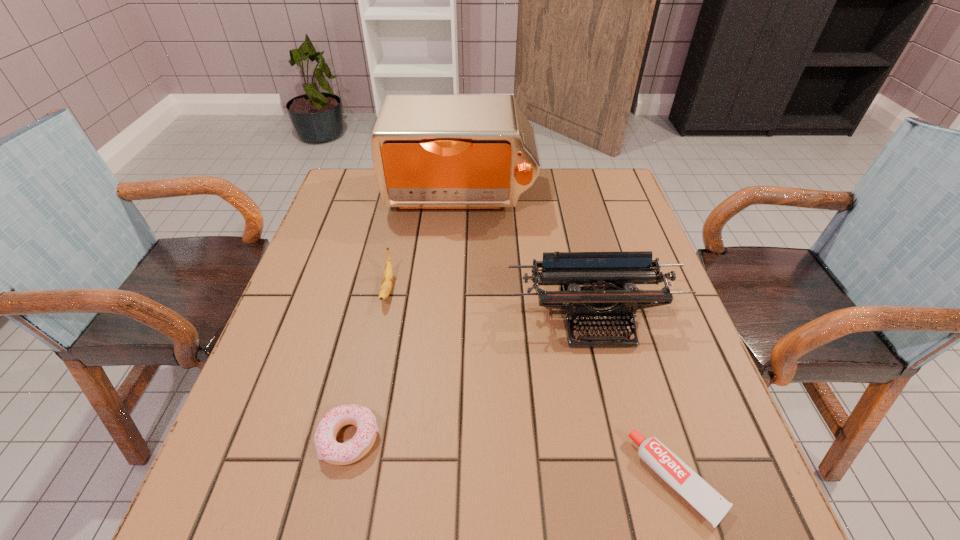
I want to click on blank region between the doughnut and the fourth shortest object, so click(472, 379).

Find the location of a particular element. free area in between the typewriter and the third shortest object is located at coordinates (492, 304).

Where is `empty space between the farthest object and the typewriter`? empty space between the farthest object and the typewriter is located at coordinates (527, 258).

Find the location of a particular element. This screenshot has height=540, width=960. object that stands as the third closest to the toothpaste is located at coordinates (387, 281).

At what (x,y) coordinates should I click in order to perform the action: click on object that stands as the third closest to the third tallest object. Please return your answer as a coordinate pair (x, y). The width and height of the screenshot is (960, 540). Looking at the image, I should click on (608, 278).

This screenshot has width=960, height=540. Find the location of `free space in the image that satisfies the following two spatial constraints: 1. on the door side of the toothpaste; 2. on the left side of the toaster oven`. free space in the image that satisfies the following two spatial constraints: 1. on the door side of the toothpaste; 2. on the left side of the toaster oven is located at coordinates (443, 480).

You are a GUI agent. You are given a task and a screenshot of the screen. Output one action in this format:
    pyautogui.click(x=<x>, y=<y>)
    Task: Click on the free location that satisfies the following two spatial constraints: 1. on the typing side of the typewriter; 2. on the left side of the toothpaste
    The height and width of the screenshot is (540, 960).
    Given the screenshot: What is the action you would take?
    tap(634, 480)

Image resolution: width=960 pixels, height=540 pixels. I want to click on vacant space that satisfies the following two spatial constraints: 1. on the typing side of the typewriter; 2. on the right side of the shortest object, so click(x=634, y=480).